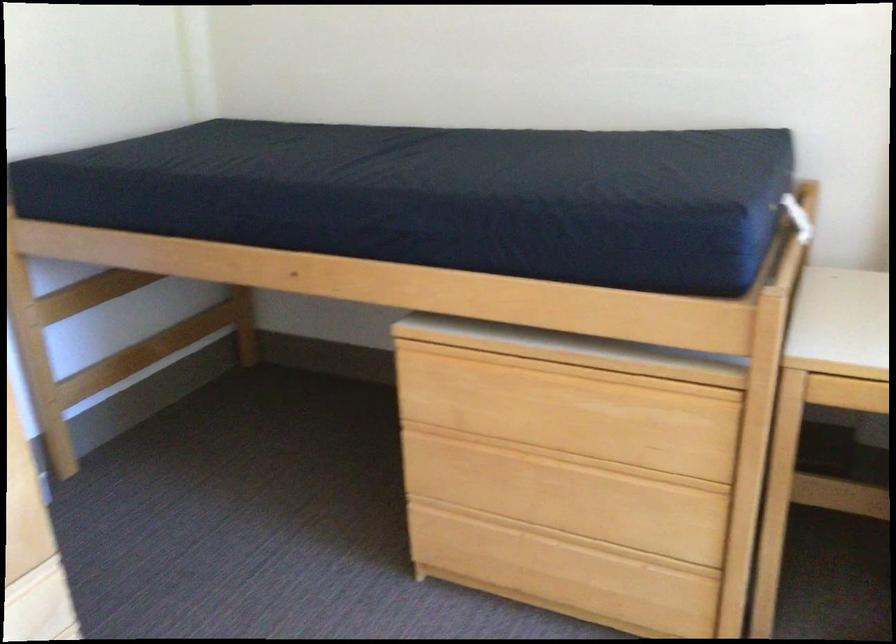
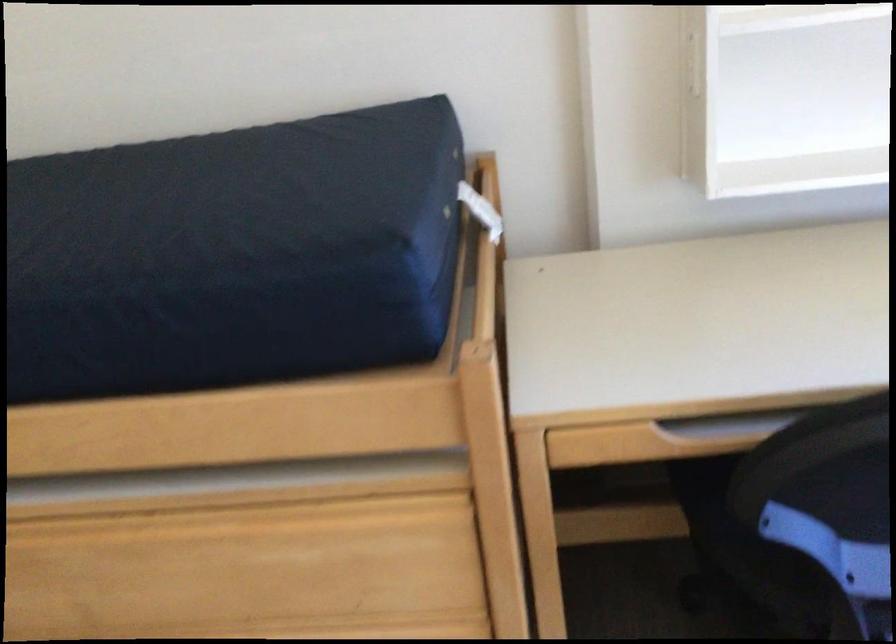
Based on the photo, what movement of the cameraman would produce the second image?

The cameraman moved toward right, forward.